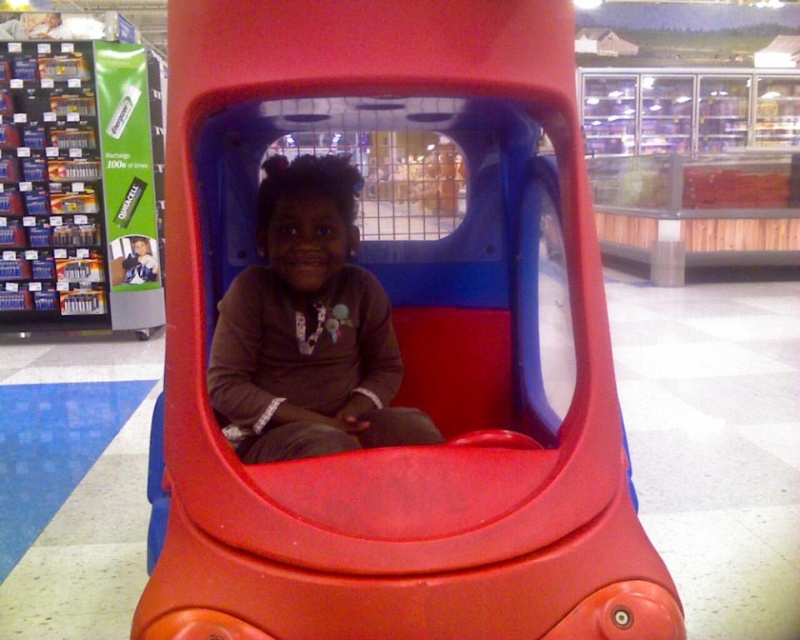
Question: Among these points, which one is farthest from the camera?

Choices:
 (A) (442, 364)
 (B) (310, 280)

Answer: (A)

Question: Does matte plastic toy car at center have a lesser width compared to matte brown shirt at center?

Choices:
 (A) no
 (B) yes

Answer: (A)

Question: Which object is closer to the camera taking this photo?

Choices:
 (A) matte plastic toy car at center
 (B) matte brown shirt at center

Answer: (A)

Question: Which of the following is the farthest from the observer?

Choices:
 (A) (389, 401)
 (B) (210, 296)

Answer: (B)

Question: Can you confirm if matte plastic toy car at center is smaller than matte brown shirt at center?

Choices:
 (A) yes
 (B) no

Answer: (B)

Question: In this image, where is matte plastic toy car at center located relative to matte brown shirt at center?

Choices:
 (A) left
 (B) right

Answer: (B)